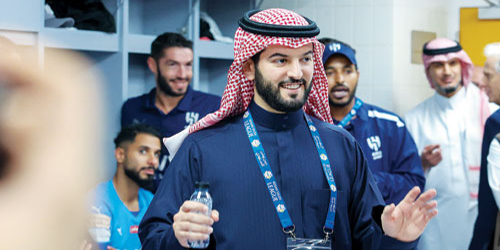
This screenshot has width=500, height=250. I want to click on clear bottle with black cap, so click(199, 194).